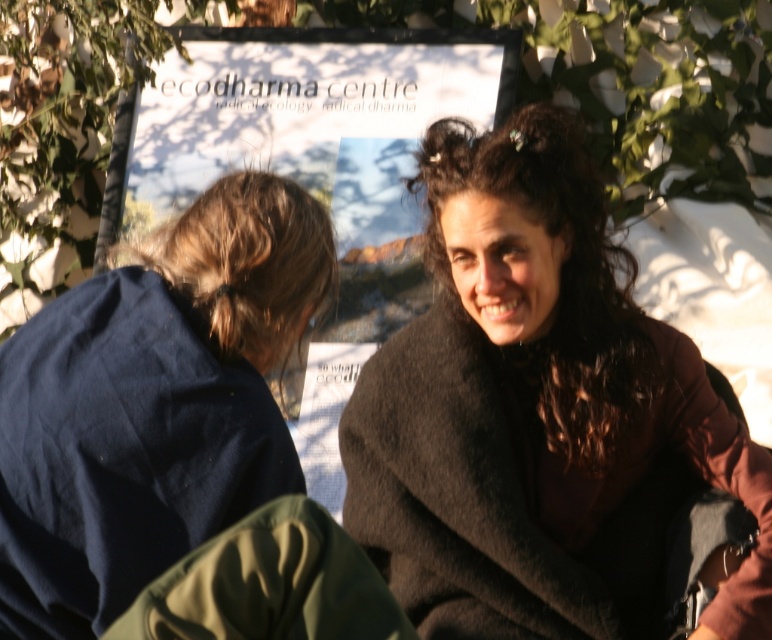
The width and height of the screenshot is (772, 640). What do you see at coordinates (530, 403) in the screenshot?
I see `brown woolen coat at center` at bounding box center [530, 403].

Can you confirm if brown woolen coat at center is wider than dark brown fur coat at center?

Yes.

Is point (422, 412) more distant than point (513, 195)?

Yes, it is.

I want to click on brown woolen coat at center, so click(x=530, y=403).

Does dark brown fur coat at center have a lesser width compared to brown hair at left?

In fact, dark brown fur coat at center might be wider than brown hair at left.

Does point (557, 136) come closer to viewer compared to point (193, 256)?

No, it is behind (193, 256).

You are a GUI agent. You are given a task and a screenshot of the screen. Output one action in this format:
    pyautogui.click(x=<x>, y=<y>)
    Task: Click on the dark brown fur coat at center
    The width and height of the screenshot is (772, 640).
    Given the screenshot: What is the action you would take?
    pyautogui.click(x=554, y=272)

Who is shorter, brown woolen coat at center or brown fuzzy blanket at upper right?

brown fuzzy blanket at upper right is shorter.

This screenshot has width=772, height=640. What do you see at coordinates (530, 403) in the screenshot?
I see `brown woolen coat at center` at bounding box center [530, 403].

Does point (543, 628) come in front of point (279, 488)?

That is False.

Locate an element on the screen. This screenshot has width=772, height=640. brown woolen coat at center is located at coordinates (530, 403).